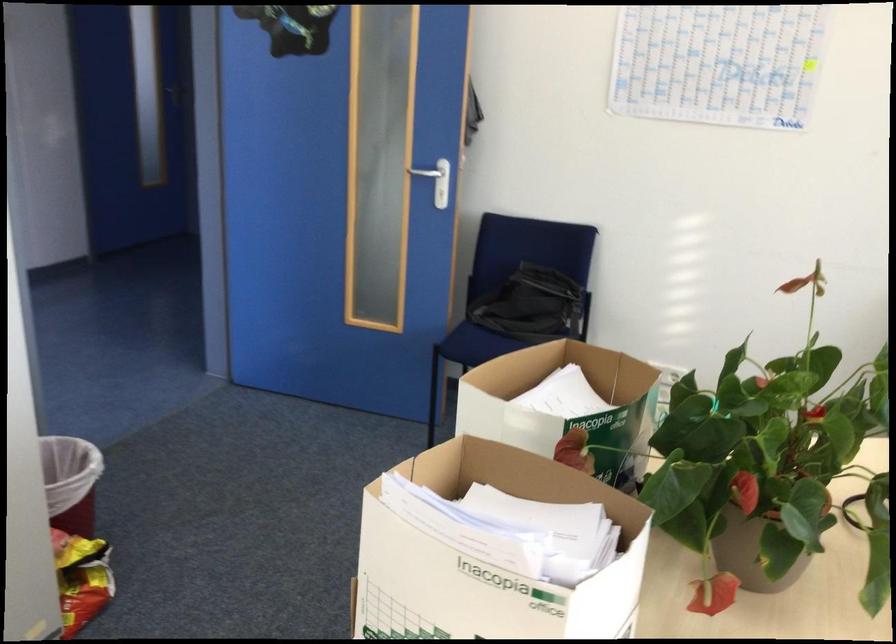
Where would you pull the white door handle? Please return your answer as a coordinate pair (x, y).

(424, 172)